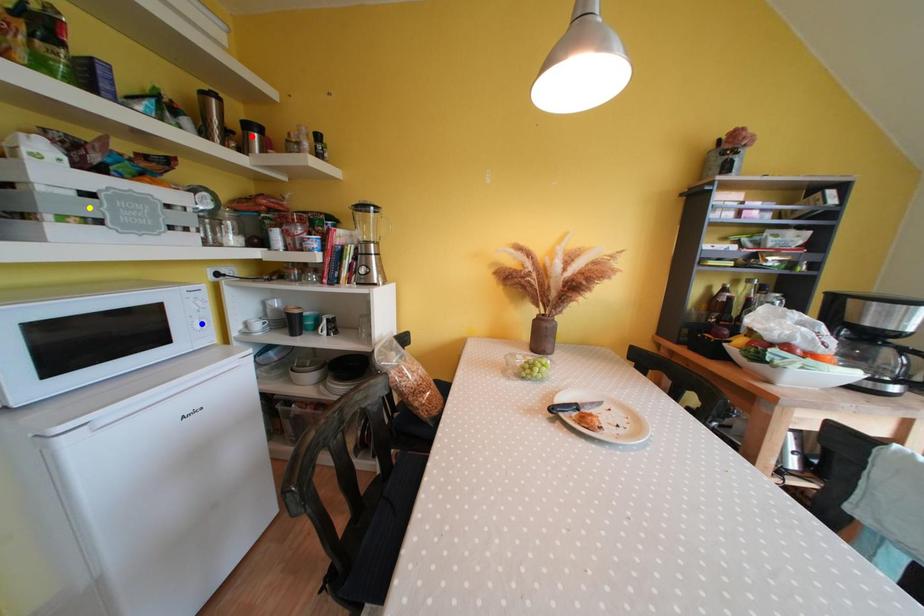
Order these from nearest to farthest:
1. yellow point
2. blue point
3. red point

yellow point
red point
blue point